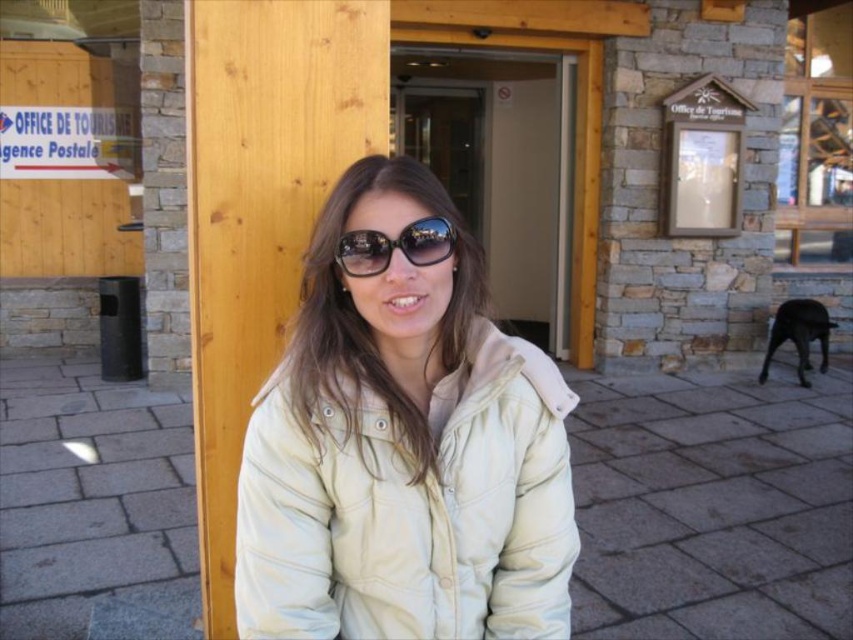
You are a photographer trying to capture the person in the scene. You notice the white matte jacket at center and the black reflective sunglasses at center. Which object is positioned more to the right from your viewpoint?

The white matte jacket at center is to the right of the black reflective sunglasses at center, so the white matte jacket at center is positioned more to the right.

You are a photographer trying to capture a clear shot of both the white matte jacket at center and the black reflective sunglasses at center. Since you want to ensure both are visible, which object should you focus on first to account for their sizes?

The white matte jacket at center is larger in size than the black reflective sunglasses at center, so you should focus on the white matte jacket at center first as it occupies more space in the frame, ensuring it is sharp before adjusting for the smaller sunglasses.